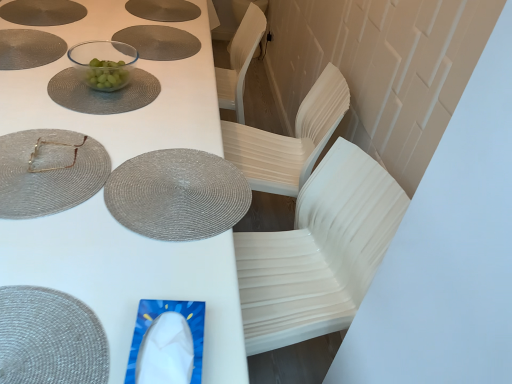
Where is `vacant space that is to the left of transparent glass bowl at upper center, the 1th glass plate positioned from the top`? The image size is (512, 384). vacant space that is to the left of transparent glass bowl at upper center, the 1th glass plate positioned from the top is located at coordinates (31, 64).